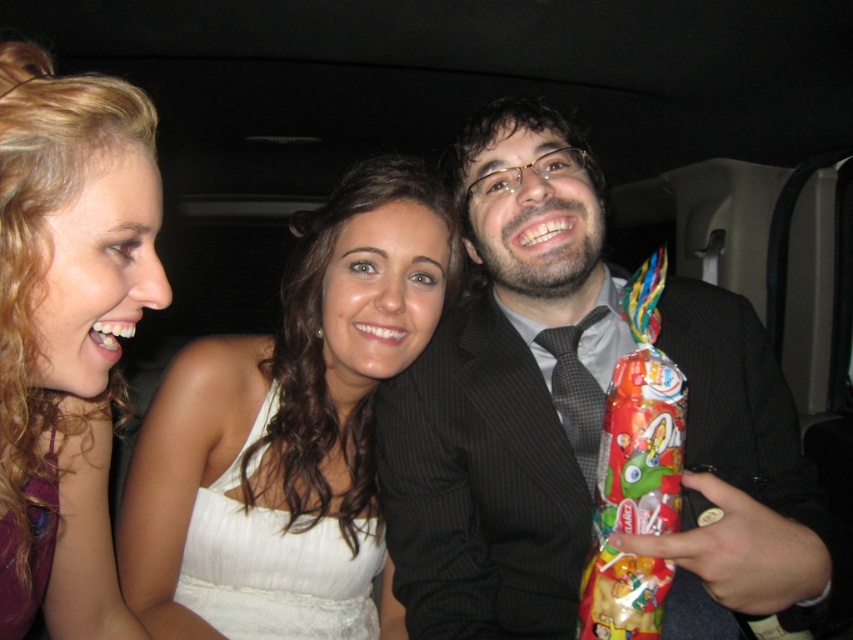
You are a photographer trying to capture a group photo of the three people in the car. You want to ensure that the white satin dress at center and the blonde curly hair at upper left are both clearly visible in the frame. Based on their sizes, which one should you focus on first to ensure proper exposure?

The white satin dress at center is taller than the blonde curly hair at upper left, so focusing on the white satin dress at center first would ensure proper exposure since it occupies more space in the frame.

You are sitting in the backseat of the car and want to reach the point at coordinates point (474,160) and point (15,474). Which point is farther from you?

The point at coordinates point (474,160) is farther from you because it is behind point (15,474), which is closer to you.

You are a photographer standing in front of the vehicle where three people are seated. You want to take a photo of the black pinstripe suit at center. Based on its position coordinates, is it likely centered in the frame?

The black pinstripe suit at center is located at coordinates point [506,392], which is slightly off the exact center but still near the middle of the frame. Therefore, it is likely centered in the frame for photography purposes.